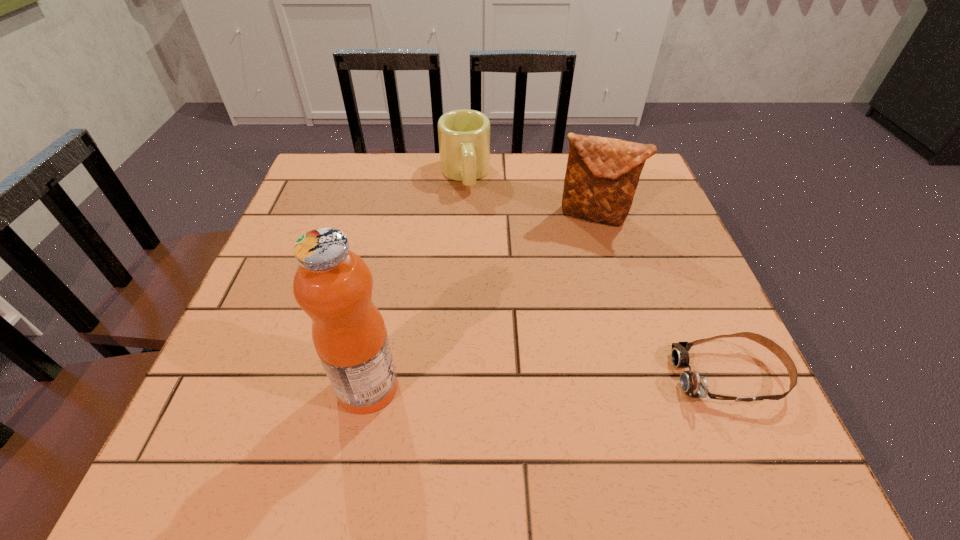
The image size is (960, 540). In order to click on free spot on the desktop that is between the tallest object and the goggles and is positioned on the open side of the second farthest object in this screenshot , I will do `click(519, 382)`.

Where is `free space on the desktop that is between the tallest object and the shortest object and is positioned with the handle on the side of the farthest object`? free space on the desktop that is between the tallest object and the shortest object and is positioned with the handle on the side of the farthest object is located at coordinates (503, 383).